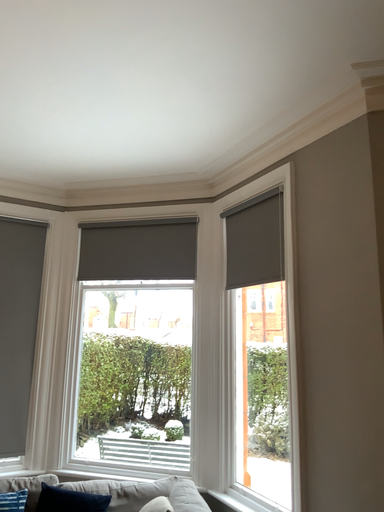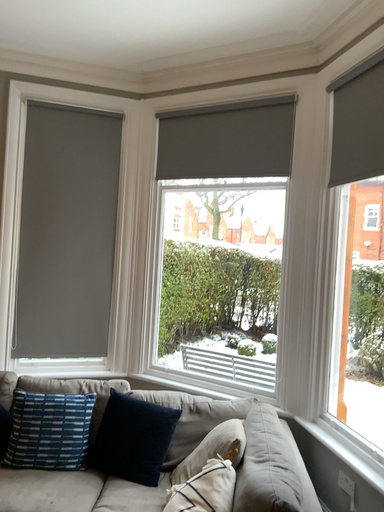
Question: How did the camera likely rotate when shooting the video?

Choices:
 (A) rotated upward
 (B) rotated downward

Answer: (B)